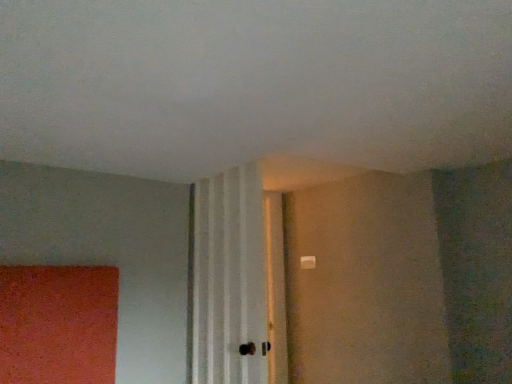
Describe the element at coordinates (229, 278) in the screenshot. I see `white textured curtain at center` at that location.

You are a GUI agent. You are given a task and a screenshot of the screen. Output one action in this format:
    pyautogui.click(x=<x>, y=<y>)
    Task: Click on the white textured curtain at center
    
    Given the screenshot: What is the action you would take?
    pyautogui.click(x=229, y=278)

Locate an element on the screen. white textured curtain at center is located at coordinates (229, 278).